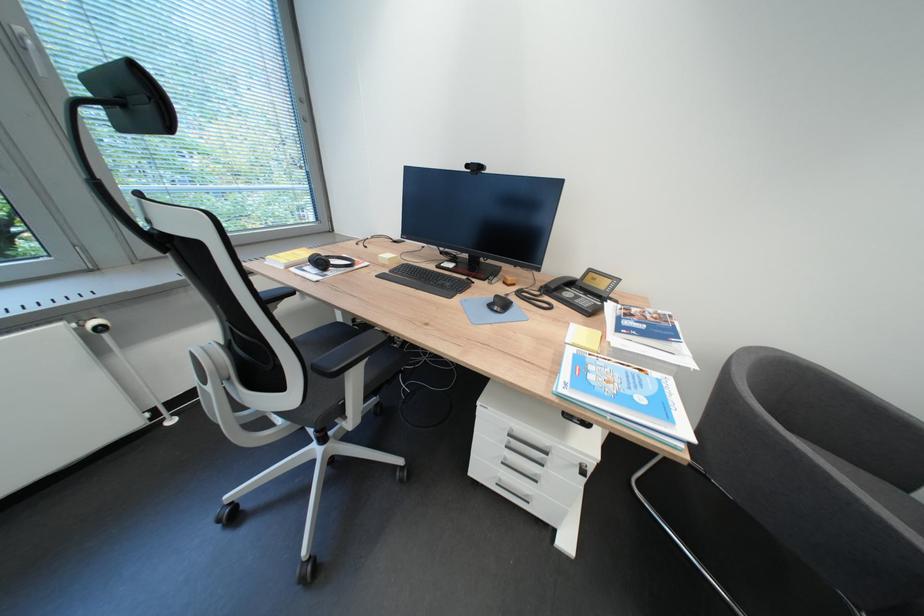
The width and height of the screenshot is (924, 616). What do you see at coordinates (96, 325) in the screenshot?
I see `a radiator control valve` at bounding box center [96, 325].